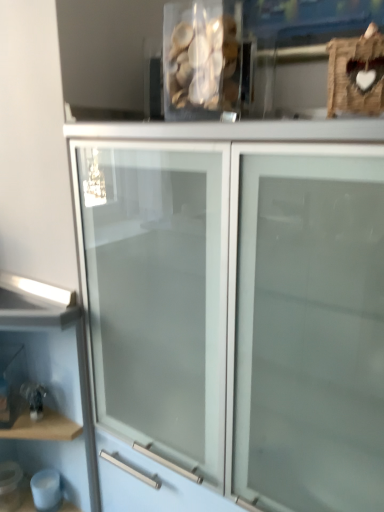
Measure the distance between point (351, 379) and camera.

The distance of point (351, 379) from camera is 67.70 centimeters.

What do you see at coordinates (203, 61) in the screenshot? The width and height of the screenshot is (384, 512). I see `translucent plastic container at upper center` at bounding box center [203, 61].

Image resolution: width=384 pixels, height=512 pixels. What do you see at coordinates (47, 387) in the screenshot?
I see `wooden shelf at lower left` at bounding box center [47, 387].

The width and height of the screenshot is (384, 512). In order to click on white frosted glass cabinet at center in this screenshot , I will do `click(236, 308)`.

Looking at this image, from a real-world perspective, who is located lower, translucent plastic container at upper center or wooden shelf at lower left?

In real-world perspective, wooden shelf at lower left is lower.

Based on the photo, measure the distance from translucent plastic container at upper center to wooden shelf at lower left.

translucent plastic container at upper center and wooden shelf at lower left are 29.68 inches apart.

Does translucent plastic container at upper center have a lesser width compared to wooden shelf at lower left?

Yes, translucent plastic container at upper center is thinner than wooden shelf at lower left.

Considering the relative positions of translucent plastic container at upper center and wooden shelf at lower left in the image provided, is translucent plastic container at upper center to the right of wooden shelf at lower left from the viewer's perspective?

Yes, translucent plastic container at upper center is to the right of wooden shelf at lower left.

Is translucent plastic container at upper center facing towards white frosted glass cabinet at center?

No.

How much distance is there between translucent plastic container at upper center and white frosted glass cabinet at center?

A distance of 16.47 inches exists between translucent plastic container at upper center and white frosted glass cabinet at center.

Is translucent plastic container at upper center positioned beyond the bounds of white frosted glass cabinet at center?

Absolutely, translucent plastic container at upper center is external to white frosted glass cabinet at center.

Between translucent plastic container at upper center and white frosted glass cabinet at center, which one appears on the right side from the viewer's perspective?

Positioned to the right is white frosted glass cabinet at center.

Is wooden shelf at lower left oriented towards translucent plastic container at upper center?

No, wooden shelf at lower left is not turned towards translucent plastic container at upper center.

Is wooden shelf at lower left closer to the viewer compared to translucent plastic container at upper center?

No, wooden shelf at lower left is further to the viewer.

Can you confirm if wooden shelf at lower left is shorter than translucent plastic container at upper center?

No.

Is white frosted glass cabinet at center smaller than wooden shelf at lower left?

No.

In the image, is white frosted glass cabinet at center on the left side or the right side of wooden shelf at lower left?

Based on their positions, white frosted glass cabinet at center is located to the right of wooden shelf at lower left.

Considering the relative sizes of white frosted glass cabinet at center and wooden shelf at lower left in the image provided, is white frosted glass cabinet at center shorter than wooden shelf at lower left?

In fact, white frosted glass cabinet at center may be taller than wooden shelf at lower left.

Is wooden shelf at lower left bigger than white frosted glass cabinet at center?

Incorrect, wooden shelf at lower left is not larger than white frosted glass cabinet at center.

Between wooden shelf at lower left and white frosted glass cabinet at center, which one is positioned behind?

wooden shelf at lower left is behind.

At what (x,y) coordinates should I click in order to perform the action: click on cupboard on the right of wooden shelf at lower left. Please return your answer as a coordinate pair (x, y). This screenshot has height=512, width=384. Looking at the image, I should click on (236, 308).

What's the angular difference between wooden shelf at lower left and white frosted glass cabinet at center's facing directions?

There is a 0.924-degree angle between the facing directions of wooden shelf at lower left and white frosted glass cabinet at center.

From the image's perspective, between white frosted glass cabinet at center and translucent plastic container at upper center, who is located below?

From the image's view, white frosted glass cabinet at center is below.

Consider the image. Can you confirm if white frosted glass cabinet at center is bigger than translucent plastic container at upper center?

Indeed, white frosted glass cabinet at center has a larger size compared to translucent plastic container at upper center.

Is point (234, 162) closer to viewer compared to point (229, 80)?

Yes, point (234, 162) is in front of point (229, 80).

Is white frosted glass cabinet at center at the right side of translucent plastic container at upper center?

Indeed, white frosted glass cabinet at center is positioned on the right side of translucent plastic container at upper center.

Locate an element on the screen. Image resolution: width=384 pixels, height=512 pixels. stuff on the right of wooden shelf at lower left is located at coordinates click(203, 61).

At what (x,y) coordinates should I click in order to perform the action: click on cupboard below the translucent plastic container at upper center (from a real-world perspective). Please return your answer as a coordinate pair (x, y). Image resolution: width=384 pixels, height=512 pixels. Looking at the image, I should click on (236, 308).

Looking at the image, which one is located further to translucent plastic container at upper center, wooden shelf at lower left or white frosted glass cabinet at center?

wooden shelf at lower left.

Looking at this image, looking at the image, which one is located closer to white frosted glass cabinet at center, wooden shelf at lower left or translucent plastic container at upper center?

wooden shelf at lower left.

Which object lies further to the anchor point wooden shelf at lower left, translucent plastic container at upper center or white frosted glass cabinet at center?

translucent plastic container at upper center is further to wooden shelf at lower left.

From the image, which object appears to be nearer to white frosted glass cabinet at center, translucent plastic container at upper center or wooden shelf at lower left?

wooden shelf at lower left lies closer to white frosted glass cabinet at center than the other object.

Which object lies nearer to the anchor point translucent plastic container at upper center, white frosted glass cabinet at center or wooden shelf at lower left?

Among the two, white frosted glass cabinet at center is located nearer to translucent plastic container at upper center.

Looking at the image, which one is located closer to wooden shelf at lower left, white frosted glass cabinet at center or translucent plastic container at upper center?

white frosted glass cabinet at center lies closer to wooden shelf at lower left than the other object.

At what (x,y) coordinates should I click in order to perform the action: click on cupboard between translucent plastic container at upper center and wooden shelf at lower left in the up-down direction. Please return your answer as a coordinate pair (x, y). This screenshot has width=384, height=512. Looking at the image, I should click on (236, 308).